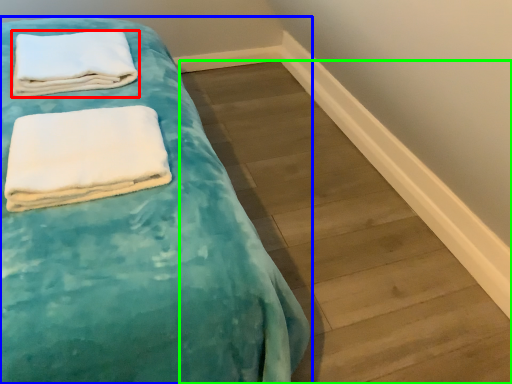
Question: Estimate the real-world distances between objects in this image. Which object is farther from towel (highlighted by a red box), bed (highlighted by a blue box) or plank (highlighted by a green box)?

Choices:
 (A) bed
 (B) plank

Answer: (B)